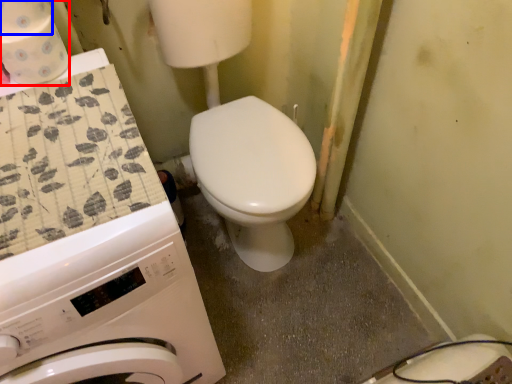
Question: Which of the following is the farthest to the observer, toilet paper (highlighted by a red box) or toilet paper (highlighted by a blue box)?

Choices:
 (A) toilet paper
 (B) toilet paper

Answer: (A)